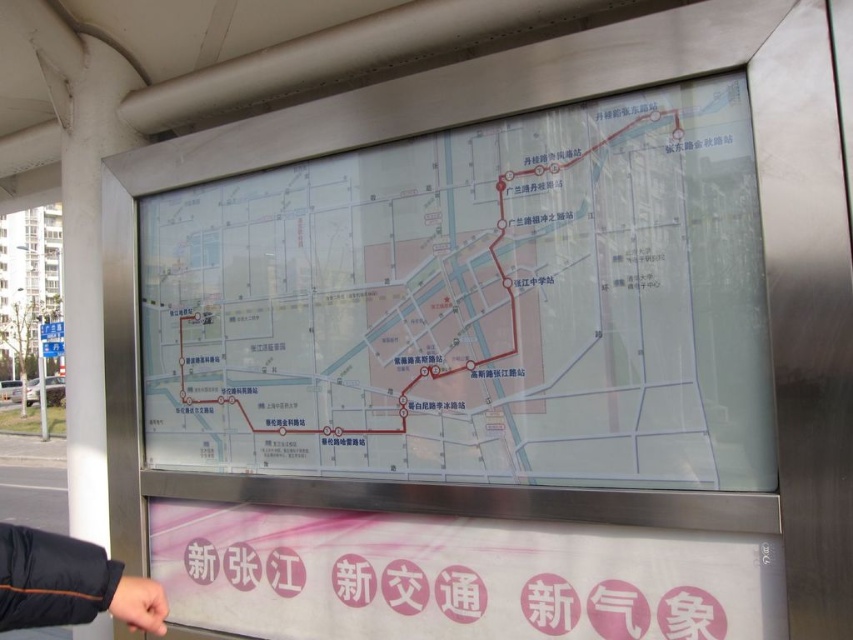
In the scene shown: You are at a bus stop in Zhangjiang and need to check the route. You see the transparent plastic map at center and the black fabric sleeve at lower left. Which object is higher up?

The transparent plastic map at center is located above the black fabric sleeve at lower left, so it is higher up.

You are a traveler at the bus stop and want to check the map. Can you see the transparent plastic map at center clearly through the black fabric sleeve at lower left?

The black fabric sleeve at lower left is behind the transparent plastic map at center, so you can see the transparent plastic map at center clearly through the black fabric sleeve at lower left because the sleeve is behind it and not obstructing the view.

You are at the bus stop and need to check the transparent plastic map at center to find your route. However, you notice a black fabric sleeve at lower left nearby. Which object is wider?

The transparent plastic map at center is wider than the black fabric sleeve at lower left according to the description.